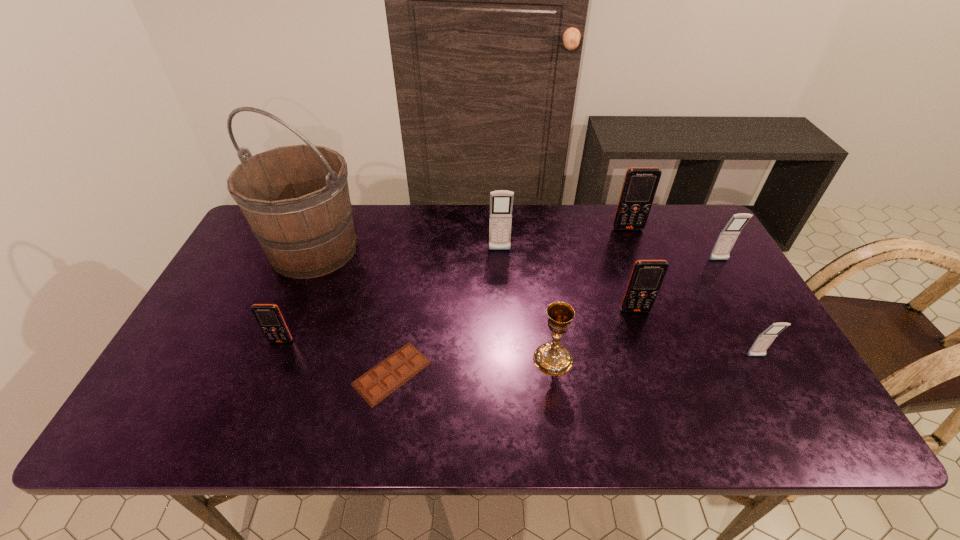
Where is `free space located on the front-facing side of the second smallest gray cellular telephone`? free space located on the front-facing side of the second smallest gray cellular telephone is located at coordinates (743, 302).

The height and width of the screenshot is (540, 960). I want to click on blank space located on the screen of the third nearest cellular telephone, so click(670, 414).

The image size is (960, 540). What are the coordinates of `free point located on the back of the chalice` in the screenshot? It's located at (540, 275).

Locate an element on the screen. The height and width of the screenshot is (540, 960). free spot located 0.210m on the screen of the leftmost orange cellular telephone is located at coordinates coord(249,422).

The height and width of the screenshot is (540, 960). In order to click on vacant space located on the front-facing side of the nearest cellular telephone in this screenshot , I will do [778, 396].

The height and width of the screenshot is (540, 960). I want to click on free region located on the left of the shortest object, so click(x=252, y=373).

I want to click on bucket present at the far edge, so click(x=296, y=199).

You are a GUI agent. You are given a task and a screenshot of the screen. Output one action in this format:
    pyautogui.click(x=<x>, y=<y>)
    Task: Click on the object present at the near edge
    The image size is (960, 540).
    Given the screenshot: What is the action you would take?
    pyautogui.click(x=383, y=379)

I want to click on object that is at the left edge, so click(296, 199).

The width and height of the screenshot is (960, 540). I want to click on object that is positioned at the far left corner, so click(x=296, y=199).